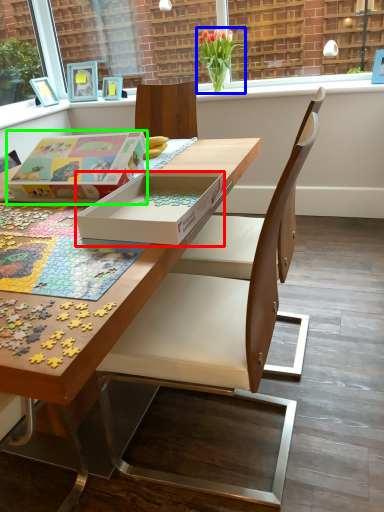
Question: Considering the real-world distances, which object is closest to box (highlighted by a red box)? flower (highlighted by a blue box) or cardboard box (highlighted by a green box).

Choices:
 (A) flower
 (B) cardboard box

Answer: (B)